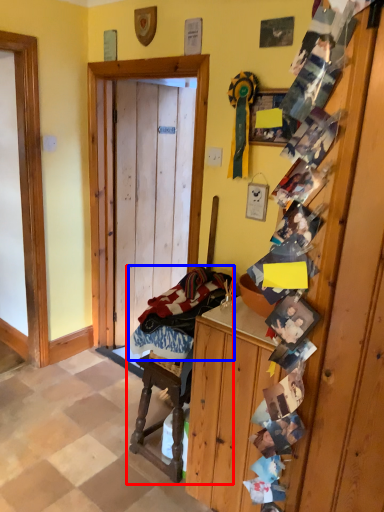
Question: Which point is closer to the camera, rocking chair (highlighted by a red box) or laundry (highlighted by a blue box)?

Choices:
 (A) rocking chair
 (B) laundry

Answer: (B)